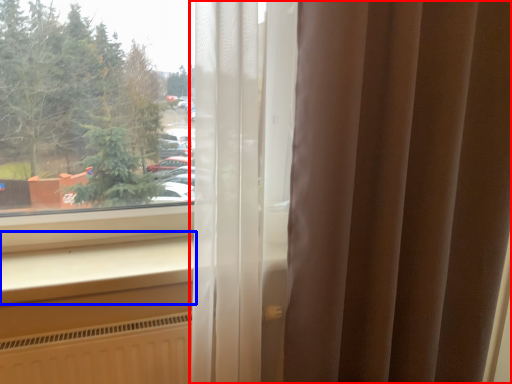
Question: Which of the following is the closest to the observer, curtain (highlighted by a red box) or window sill (highlighted by a blue box)?

Choices:
 (A) curtain
 (B) window sill

Answer: (A)